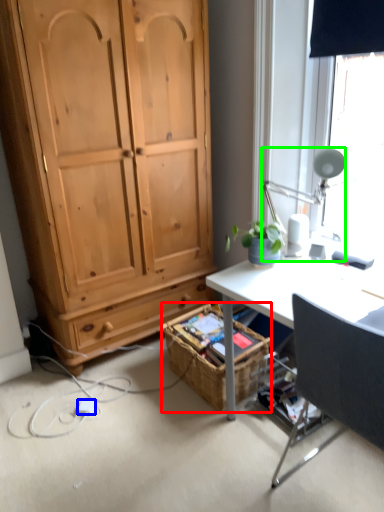
Question: Estimate the real-world distances between objects in this image. Which object is farther from picnic basket (highlighted by a red box), power outlet (highlighted by a blue box) or lamp (highlighted by a green box)?

Choices:
 (A) power outlet
 (B) lamp

Answer: (B)